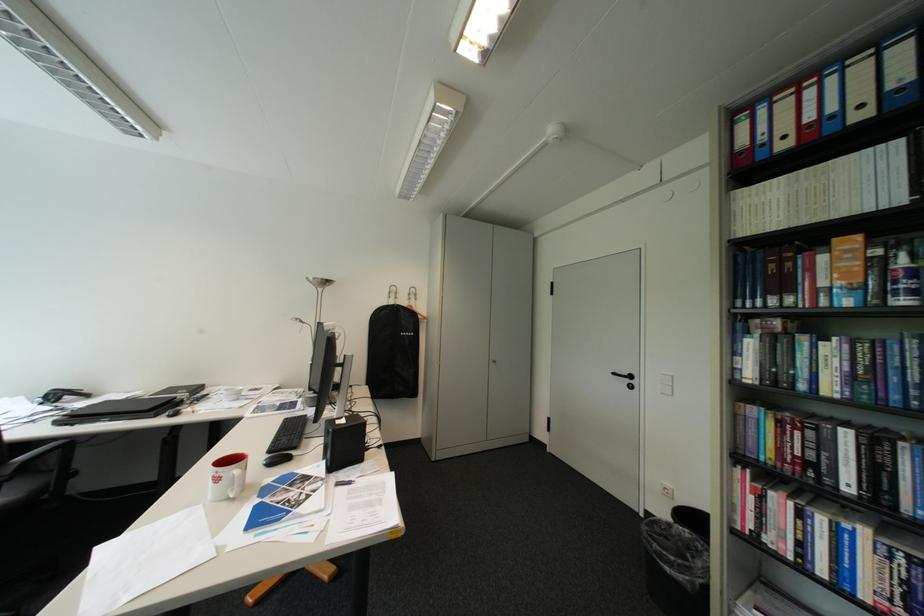
What do you see at coordinates (62, 394) in the screenshot? The width and height of the screenshot is (924, 616). I see `the black telephone handset` at bounding box center [62, 394].